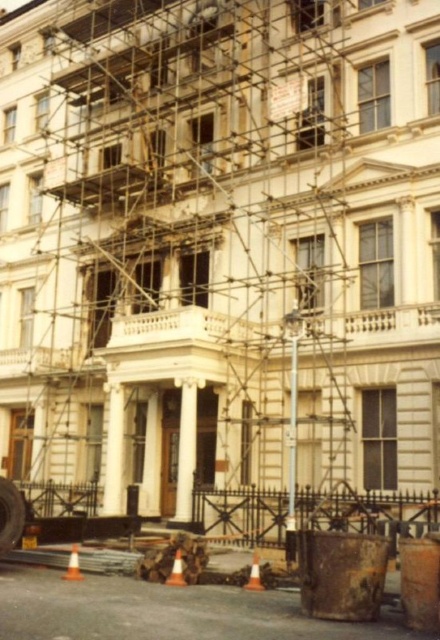
Question: Which is nearer to the orange plastic cone at lower left?

Choices:
 (A) orange traffic cone at lower center
 (B) white marble column at center
 (C) rusty metal dumpster at lower right

Answer: (C)

Question: Based on their relative distances, which object is farther from the orange traffic cone at lower center?

Choices:
 (A) orange plastic cone at lower center
 (B) rusty metal dumpster at lower right
 (C) metallic scaffolding at center

Answer: (C)

Question: Does metallic scaffolding at center lie behind white marble column at center?

Choices:
 (A) no
 (B) yes

Answer: (A)

Question: Which point is farther to the camera?

Choices:
 (A) (238, 195)
 (B) (80, 573)

Answer: (A)

Question: Is the position of orange plastic cone at lower left less distant than that of orange traffic cone at lower center?

Choices:
 (A) no
 (B) yes

Answer: (A)

Question: From the image, what is the correct spatial relationship of orange plastic cone at lower center in relation to orange plastic cone at lower left?

Choices:
 (A) right
 (B) left

Answer: (A)